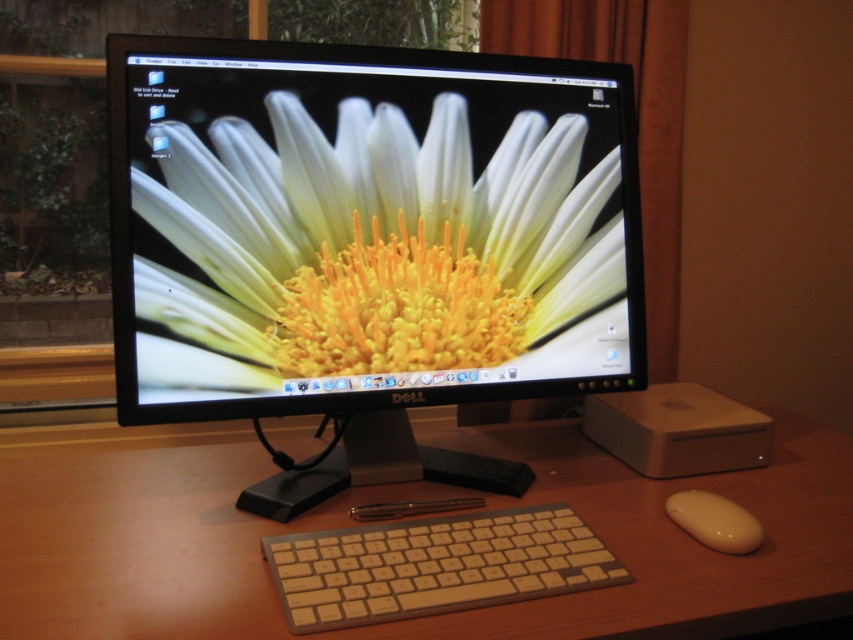
Question: Does beige plastic keyboard at center appear under white glossy mouse at lower right?

Choices:
 (A) yes
 (B) no

Answer: (A)

Question: Which of the following is the farthest from the observer?

Choices:
 (A) beige plastic keyboard at center
 (B) matte plastic monitor at center
 (C) white glossy mouse at lower right
 (D) wooden at center

Answer: (B)

Question: Is matte plastic monitor at center positioned behind wooden at center?

Choices:
 (A) yes
 (B) no

Answer: (A)

Question: Which point is farther to the camera?

Choices:
 (A) beige plastic keyboard at center
 (B) white glossy mouse at lower right
 (C) matte plastic monitor at center
 (D) wooden at center

Answer: (C)

Question: Can you confirm if beige plastic keyboard at center is positioned above white glossy mouse at lower right?

Choices:
 (A) no
 (B) yes

Answer: (A)

Question: Which is nearer to the white glossy mouse at lower right?

Choices:
 (A) matte plastic monitor at center
 (B) beige plastic keyboard at center

Answer: (B)